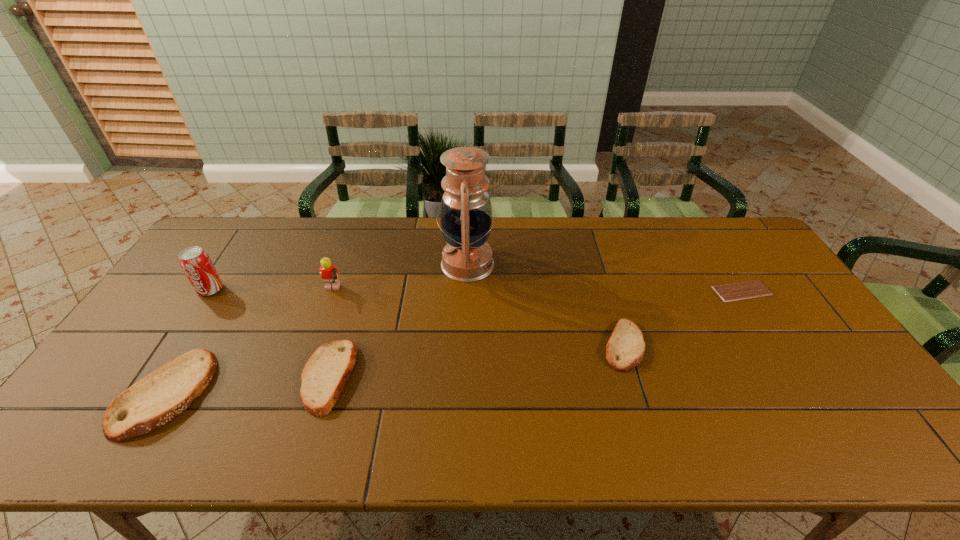
Identify which pita bread is located as the second nearest to the sixth tallest object. Please provide its 2D coordinates. Your answer should be formatted as a tuple, i.e. [(x, y)], where the tuple contains the x and y coordinates of a point satisfying the conditions above.

[(163, 394)]

The image size is (960, 540). Identify the location of the third closest pita bread to the sixth shortest object. (625, 348).

Identify the location of free space that satisfies the following two spatial constraints: 1. on the back side of the shortest object; 2. on the left side of the second pita bread from left to right. (354, 291).

The height and width of the screenshot is (540, 960). I want to click on vacant area in the image that satisfies the following two spatial constraints: 1. on the logo side of the second tallest object; 2. on the right side of the second pita bread from left to right, so click(x=154, y=376).

At what (x,y) coordinates should I click in order to perform the action: click on vacant area that satisfies the following two spatial constraints: 1. in front of the Lego with the accessory visible; 2. on the back side of the second tallest pita bread. Please return your answer as a coordinate pair (x, y). This screenshot has width=960, height=540. Looking at the image, I should click on (301, 376).

Identify the location of vacant space that satisfies the following two spatial constraints: 1. in front of the Lego with the accessory visible; 2. on the front side of the tallest pita bread. (295, 394).